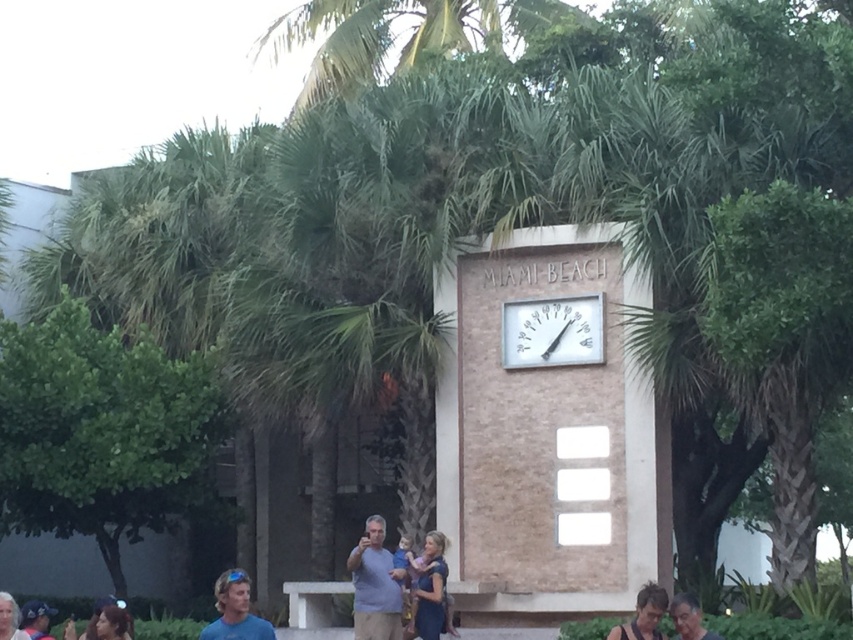
Question: Is brown textured shirt at lower right smaller than dark brown hair at lower left?

Choices:
 (A) yes
 (B) no

Answer: (B)

Question: Estimate the real-world distances between objects in this image. Which object is closer to the matte black hair at lower left?

Choices:
 (A) dark brown hair at lower left
 (B) white metallic clock at center
 (C) denim cap at lower left

Answer: (A)

Question: Which of the following is the farthest from the observer?

Choices:
 (A) 538,336
 (B) 440,618
 (C) 650,580
 (D) 27,440

Answer: (D)

Question: Is blue matte shirt at lower left behind denim cap at lower left?

Choices:
 (A) no
 (B) yes

Answer: (A)

Question: Which object is the farthest from the denim cap at lower left?

Choices:
 (A) matte black hair at lower left
 (B) brown textured shirt at lower right
 (C) smooth skin face at lower right
 (D) dark brown hair at lower left

Answer: (C)

Question: Is matte black hair at lower left wider than blonde hair at lower left?

Choices:
 (A) yes
 (B) no

Answer: (A)